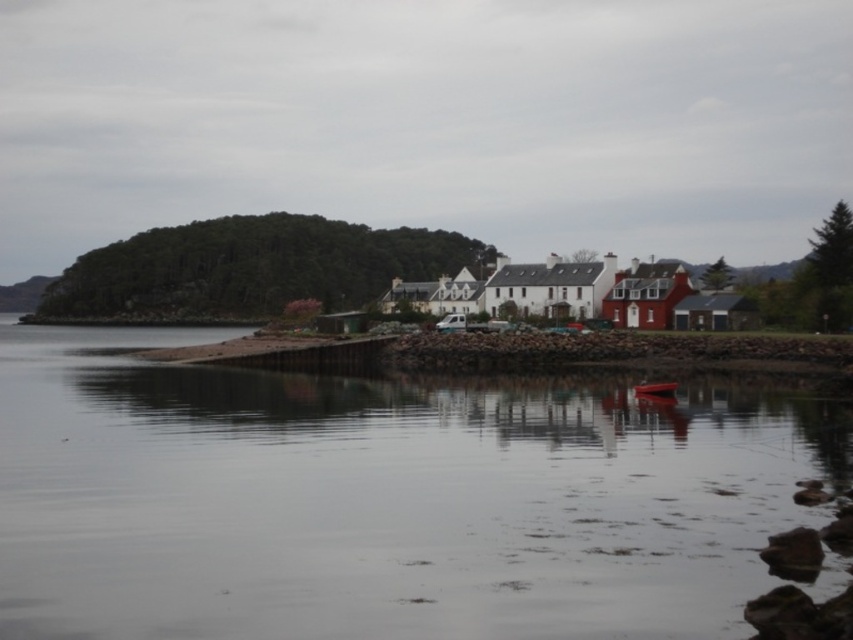
You are standing on the dock and want to sail to the green forested island at left using the metallic red boat at center. Which direction should you head?

The green forested island at left is to the left of the metallic red boat at center, so you should head left from the metallic red boat at center to reach the green forested island at left.

Consider the image. You are a visitor at the coastal scene. You want to take a photo of the metallic red boat at center and the smooth water at center. Which object should you focus on first if you want to capture both in the same frame without moving the camera?

The smooth water at center is below the metallic red boat at center, so you should focus on the metallic red boat at center first as it is closer to the camera. This way, both objects will be in focus when using a single focal point.